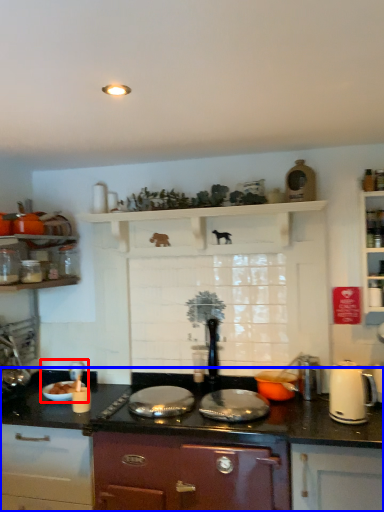
Question: Which object appears closest to the camera in this image, sink (highlighted by a red box) or countertop (highlighted by a blue box)?

Choices:
 (A) sink
 (B) countertop

Answer: (B)